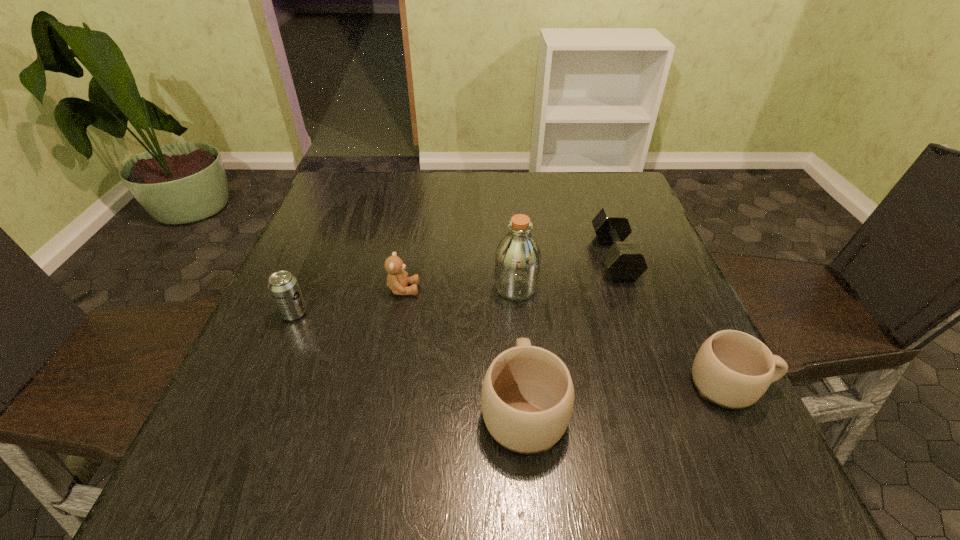
Where is `free point between the tallest object and the teddy bear`? The width and height of the screenshot is (960, 540). free point between the tallest object and the teddy bear is located at coordinates (460, 288).

Point out which object is positioned as the third nearest to the taller mug. Please provide its 2D coordinates. Your answer should be formatted as a tuple, i.e. [(x, y)], where the tuple contains the x and y coordinates of a point satisfying the conditions above.

[(732, 369)]

I want to click on object that stands as the second closest to the taller mug, so click(397, 280).

I want to click on vacant point that satisfies the following two spatial constraints: 1. on the face of the second object from left to right; 2. on the side of the left mug with the handle, so click(x=381, y=407).

This screenshot has width=960, height=540. Find the location of `free space in the image that satisfies the following two spatial constraints: 1. on the side of the left mug with the handle; 2. on the face of the fifth object from right to left`. free space in the image that satisfies the following two spatial constraints: 1. on the side of the left mug with the handle; 2. on the face of the fifth object from right to left is located at coordinates (514, 289).

At what (x,y) coordinates should I click in order to perform the action: click on free space in the image that satisfies the following two spatial constraints: 1. on the front side of the dumbbell; 2. on the face of the teddy bear. Please return your answer as a coordinate pair (x, y). The width and height of the screenshot is (960, 540). Looking at the image, I should click on (626, 289).

I want to click on free space that satisfies the following two spatial constraints: 1. on the front side of the second object from right to left; 2. on the face of the fifth object from right to left, so click(626, 289).